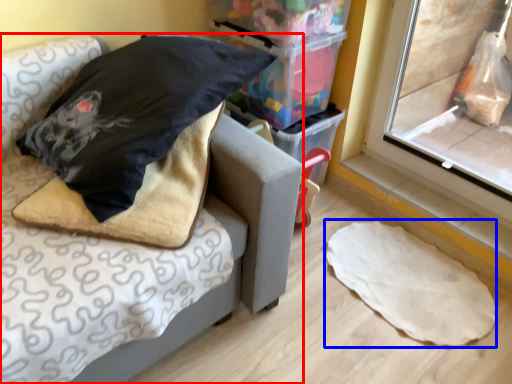
Question: Among these objects, which one is nearest to the camera, furniture (highlighted by a red box) or linen (highlighted by a blue box)?

Choices:
 (A) furniture
 (B) linen

Answer: (A)